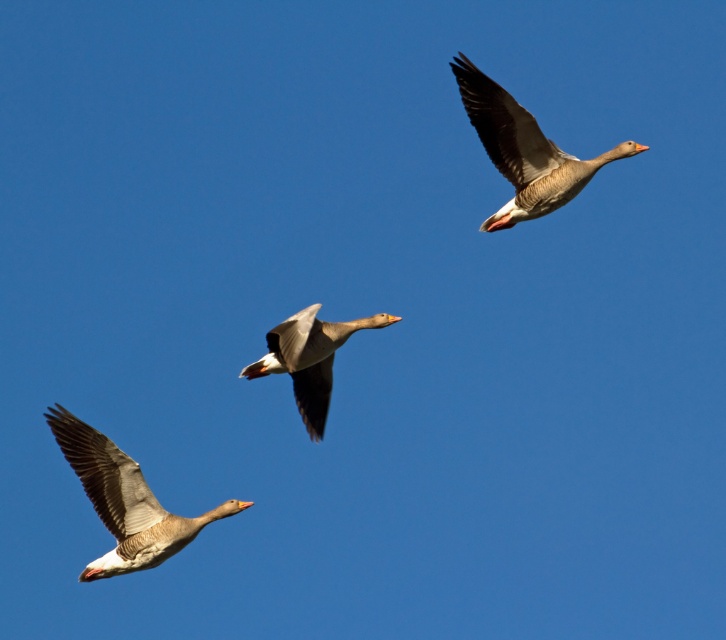
Which is behind, point (94, 570) or point (280, 340)?

Point (94, 570)

Does point (126, 477) lie in front of point (293, 392)?

Yes.

Is point (115, 456) positioned in front of point (305, 378)?

Yes, point (115, 456) is in front of point (305, 378).

At what (x,y) coordinates should I click in order to perform the action: click on gray matte goose at lower left. Please return your answer as a coordinate pair (x, y). The image size is (726, 640). Looking at the image, I should click on (123, 500).

Is point (147, 547) farther from viewer compared to point (492, 129)?

No, it is in front of (492, 129).

Which is more to the right, gray matte goose at lower left or gray matte goose at upper right?

Positioned to the right is gray matte goose at upper right.

Between point (158, 561) and point (611, 156), which one is positioned behind?

Positioned behind is point (158, 561).

At what (x,y) coordinates should I click in order to perform the action: click on gray matte goose at lower left. Please return your answer as a coordinate pair (x, y). Looking at the image, I should click on (123, 500).

Does point (499, 129) lie behind point (266, 339)?

No, (499, 129) is in front of (266, 339).

Who is more forward, [600,164] or [325,364]?

Point [600,164] is more forward.

Is point (526, 218) positioned after point (309, 323)?

Yes.

Find the location of a particular element. Image resolution: width=726 pixels, height=640 pixels. gray matte goose at upper right is located at coordinates (523, 150).